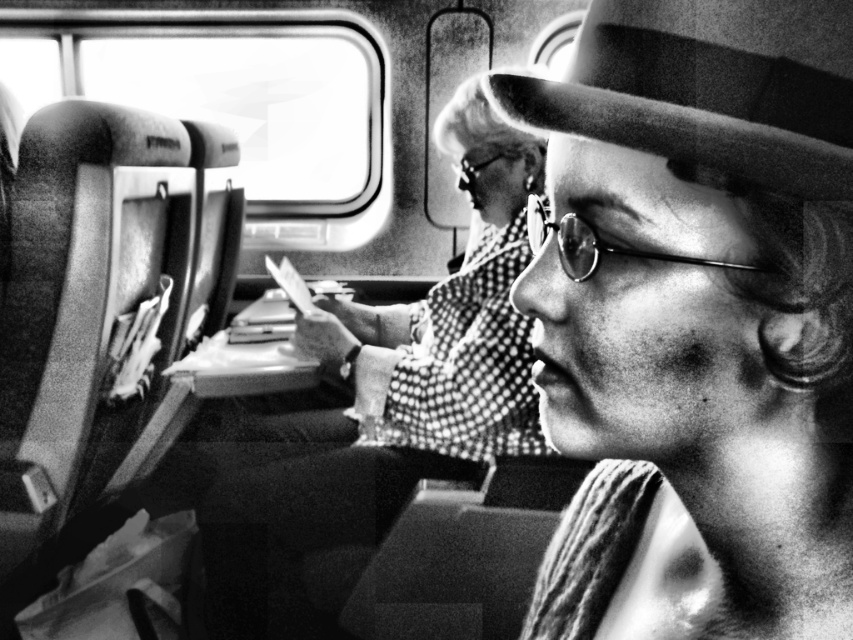
Is felt fedora at center further to the viewer compared to metallic reflective goggles at upper center?

No, it is not.

In the scene shown: Who is positioned more to the right, felt fedora at center or metallic reflective goggles at upper center?

felt fedora at center

The width and height of the screenshot is (853, 640). Find the location of `felt fedora at center`. felt fedora at center is located at coordinates (708, 88).

At what (x,y) coordinates should I click in order to perform the action: click on felt fedora at center. Please return your answer as a coordinate pair (x, y). This screenshot has height=640, width=853. Looking at the image, I should click on (708, 88).

Is striped fabric hat at center to the right of felt fedora at center from the viewer's perspective?

Indeed, striped fabric hat at center is positioned on the right side of felt fedora at center.

Does striped fabric hat at center lie in front of felt fedora at center?

Yes, striped fabric hat at center is in front of felt fedora at center.

Between point (624, 116) and point (633, 20), which one is positioned behind?

The point (633, 20) is more distant.

Image resolution: width=853 pixels, height=640 pixels. I want to click on striped fabric hat at center, so click(x=695, y=320).

Is point (746, 275) less distant than point (456, 184)?

That is True.

In the scene shown: Is striped fabric hat at center smaller than metallic reflective goggles at upper center?

No.

Which is in front, point (848, 305) or point (465, 168)?

Point (848, 305)

Locate an element on the screen. striped fabric hat at center is located at coordinates (695, 320).